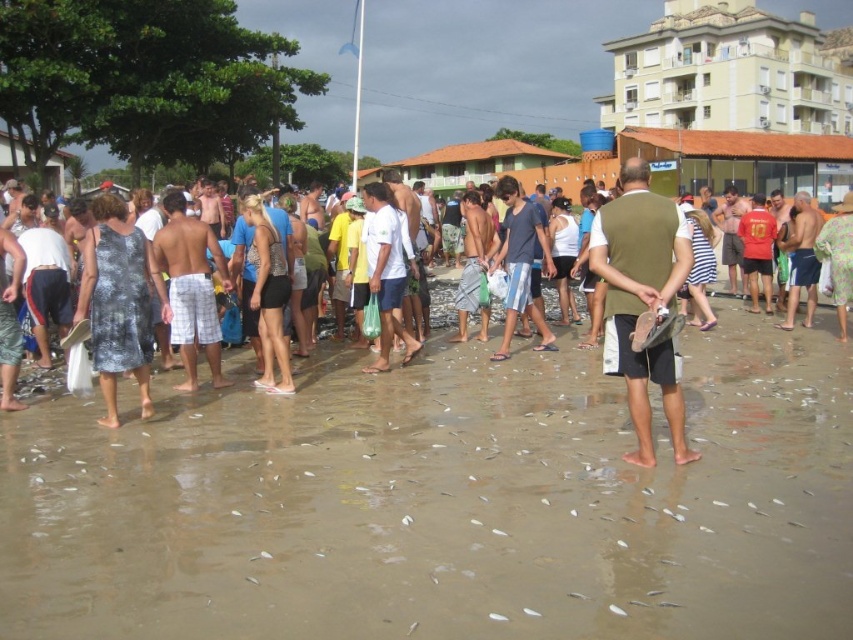
Between printed fabric dress at left and white plaid shorts at center, which one appears on the right side from the viewer's perspective?

white plaid shorts at center is more to the right.

Image resolution: width=853 pixels, height=640 pixels. I want to click on printed fabric dress at left, so click(119, 301).

Where is `printed fabric dress at left`? Image resolution: width=853 pixels, height=640 pixels. printed fabric dress at left is located at coordinates (119, 301).

Does green fabric vest at center appear over blue cotton shirt at center?

Incorrect, green fabric vest at center is not positioned above blue cotton shirt at center.

Which of these two, green fabric vest at center or blue cotton shirt at center, stands taller?

blue cotton shirt at center

Does point (601, 234) come closer to viewer compared to point (517, 204)?

Yes, it is.

This screenshot has height=640, width=853. I want to click on green fabric vest at center, so click(642, 300).

Who is lower down, brown sand at center or green fabric vest at center?

brown sand at center

Who is more forward, (x=310, y=612) or (x=635, y=452)?

Point (x=310, y=612) is in front.

Identify the location of brown sand at center. This screenshot has height=640, width=853. (445, 502).